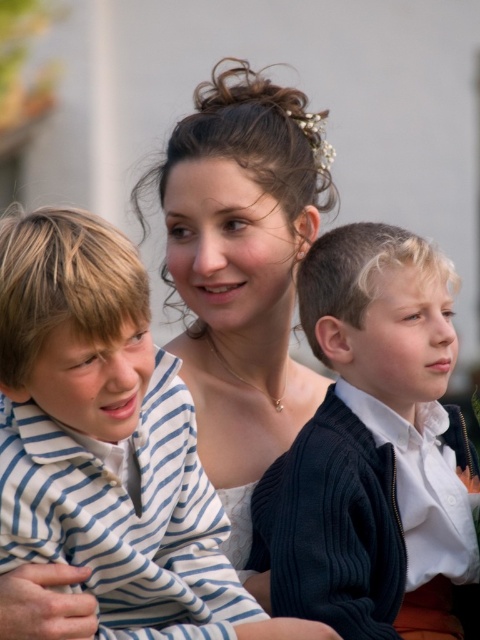
Question: Which point is closer to the camera?

Choices:
 (A) (96, 472)
 (B) (399, 244)

Answer: (A)

Question: Among these objects, which one is farthest from the camera?

Choices:
 (A) dark blue sweater at center
 (B) white striped shirt at left

Answer: (A)

Question: Is dark blue sweater at center bigger than white striped shirt at left?

Choices:
 (A) no
 (B) yes

Answer: (B)

Question: Does dark blue sweater at center appear under white striped shirt at left?

Choices:
 (A) yes
 (B) no

Answer: (A)

Question: Can you confirm if dark blue sweater at center is smaller than white striped shirt at left?

Choices:
 (A) yes
 (B) no

Answer: (B)